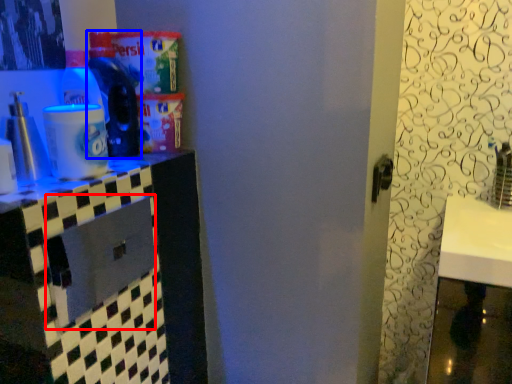
Question: Which of the following is the closest to the observer, drawer (highlighted by a red box) or bottle (highlighted by a blue box)?

Choices:
 (A) drawer
 (B) bottle

Answer: (A)